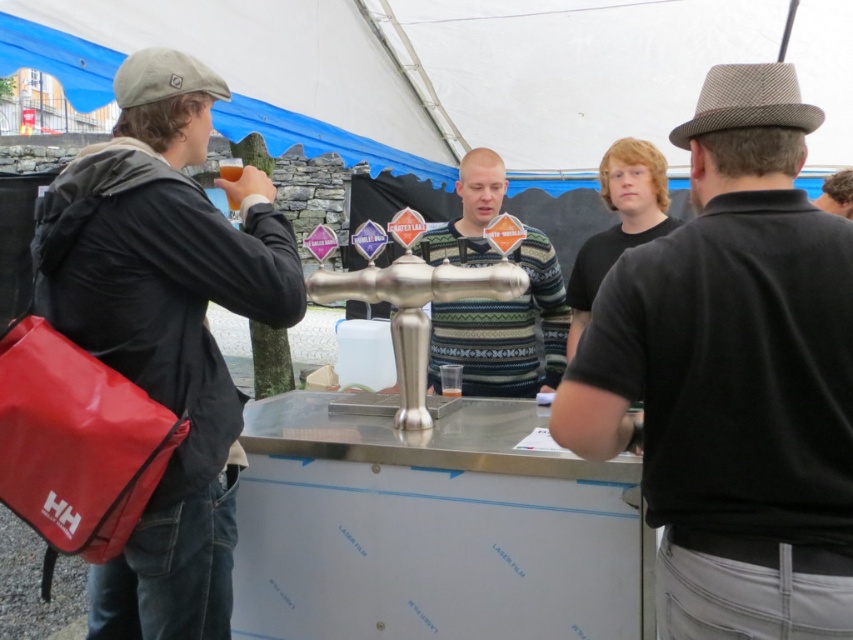
Question: Which point is closer to the camera?

Choices:
 (A) (474, 209)
 (B) (229, 534)

Answer: (B)

Question: Is black textured shirt at right to the right of matte black jacket at left from the viewer's perspective?

Choices:
 (A) yes
 (B) no

Answer: (A)

Question: Is matte black jacket at left closer to the viewer compared to striped sweater at center?

Choices:
 (A) no
 (B) yes

Answer: (B)

Question: Which of these objects is positioned farthest from the striped sweater at center?

Choices:
 (A) matte black jacket at left
 (B) smooth brown hair at upper right
 (C) black textured shirt at right

Answer: (C)

Question: Which object is positioned farthest from the smooth brown hair at upper right?

Choices:
 (A) striped sweater at center
 (B) matte black jacket at left
 (C) black textured shirt at right

Answer: (B)

Question: Can you confirm if black textured shirt at right is positioned to the right of matte black jacket at left?

Choices:
 (A) yes
 (B) no

Answer: (A)